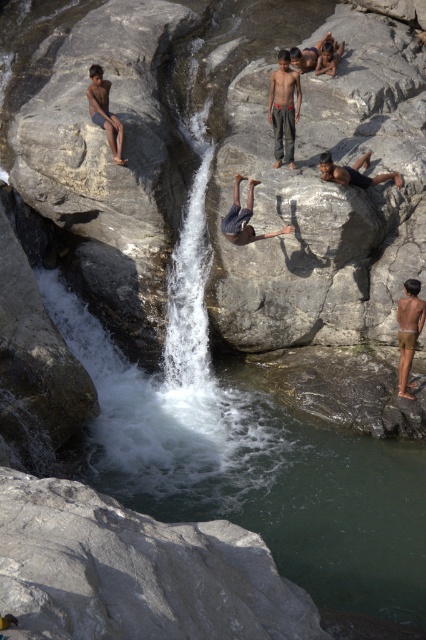
You are a hiker who wants to take a photo of the brown skin man at upper center and the gray rough rock at lower left. Which object is closer to the camera?

The gray rough rock at lower left is positioned under the brown skin man at upper center, so the brown skin man at upper center is closer to the camera.

You are a photographer standing at the edge of the waterfall. You want to take a photo that includes both the point at coordinates point(89, 520) and point(221, 225). Which point should you focus on first to ensure both are in sharp focus?

You should focus on point(89, 520) first because it is closer to the viewer than point(221, 225). By focusing on the closer point, the farther point will also be in focus due to the depth of field.

You are standing at the point with coordinates point (x=322, y=42) and want to reach the point with coordinates point (x=244, y=179). According to the scene, which direction should you move to get there?

You should move forward because point (x=244, y=179) is in front of point (x=322, y=42).